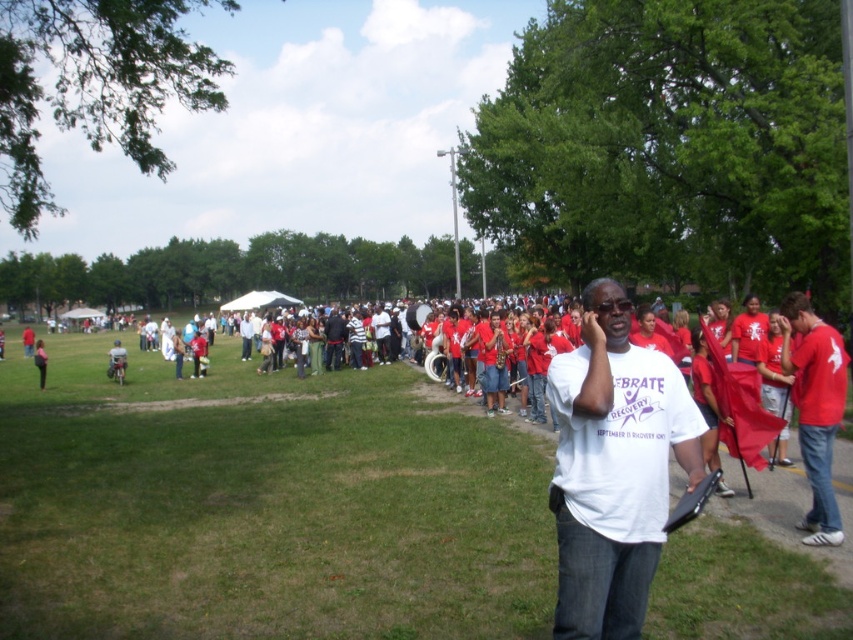
What do you see at coordinates (613, 467) in the screenshot? The image size is (853, 640). I see `white matte t-shirt at center` at bounding box center [613, 467].

Is white matte t-shirt at center wider than matte red shirt at right?

In fact, white matte t-shirt at center might be narrower than matte red shirt at right.

Who is more forward, [640,538] or [834,536]?

Point [640,538] is in front.

Where is `white matte t-shirt at center`? The height and width of the screenshot is (640, 853). white matte t-shirt at center is located at coordinates (613, 467).

Consider the image. Who is more distant from viewer, (461, 557) or (606, 406)?

The point (461, 557) is behind.

Is white cotton t-shirt at center below white matte t-shirt at center?

Indeed, white cotton t-shirt at center is positioned under white matte t-shirt at center.

What do you see at coordinates (262, 506) in the screenshot? Image resolution: width=853 pixels, height=640 pixels. I see `white cotton t-shirt at center` at bounding box center [262, 506].

Identify the location of white cotton t-shirt at center. (262, 506).

Is point (496, 458) in front of point (805, 438)?

No.

Does white cotton t-shirt at center come behind matte red shirt at right?

No, it is in front of matte red shirt at right.

Measure the distance between point (532, 536) and camera.

Answer: Point (532, 536) is 20.92 feet away from camera.

This screenshot has width=853, height=640. In order to click on white cotton t-shirt at center in this screenshot , I will do `click(262, 506)`.